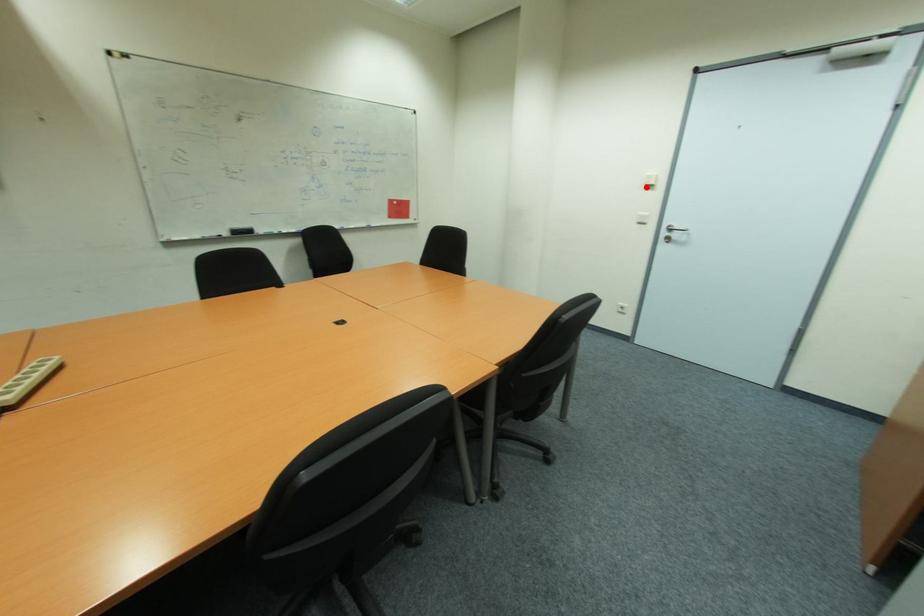
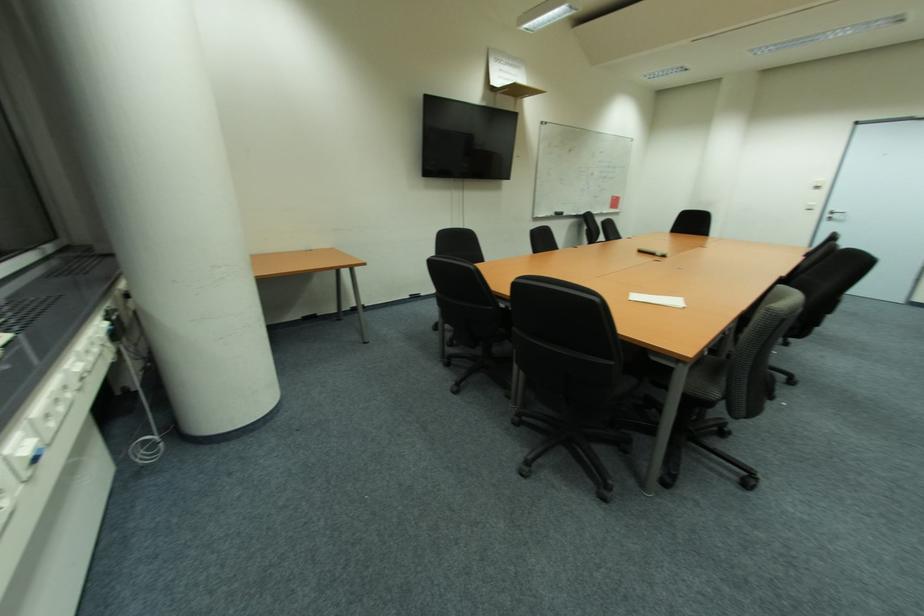
Question: I am providing you with two images of the same scene from different viewpoints. Given a red point in image1, look at the same physical point in image2. Is it:

Choices:
 (A) Closer to the viewpoint
 (B) Farther from the viewpoint

Answer: (B)